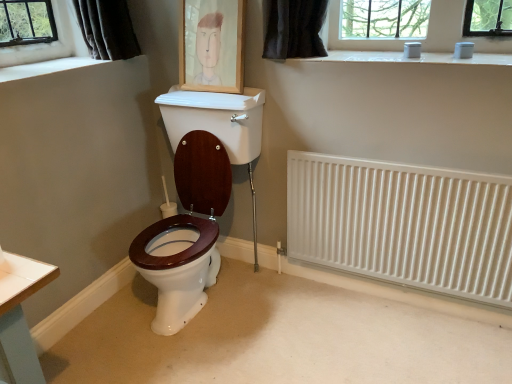
At what (x,y) coordinates should I click in order to perform the action: click on vacant region in front of white metallic radiator at right. Please return your answer as a coordinate pair (x, y). Looking at the image, I should click on (401, 338).